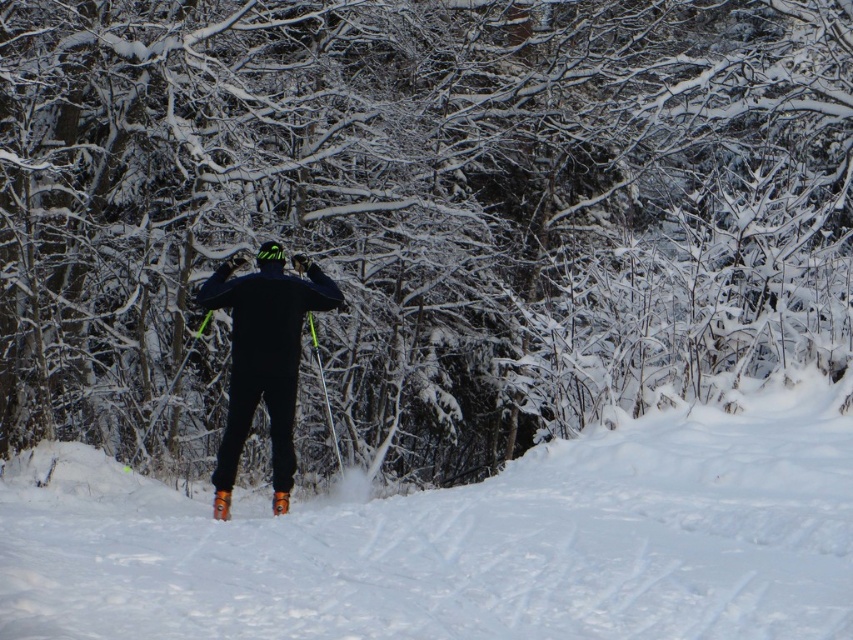
Who is positioned more to the right, white fluffy snow at center or matte black snowboarder at center?

From the viewer's perspective, white fluffy snow at center appears more on the right side.

Between white fluffy snow at center and matte black snowboarder at center, which one is positioned higher?

matte black snowboarder at center is above.

Measure the distance between point (798, 465) and camera.

They are 11.46 meters apart.

Find the location of `white fluffy snow at center`. white fluffy snow at center is located at coordinates (465, 540).

How distant is matte black snowboarder at center from orange plastic ski at lower center?

matte black snowboarder at center is 3.88 feet from orange plastic ski at lower center.

At what (x,y) coordinates should I click in order to perform the action: click on matte black snowboarder at center. Please return your answer as a coordinate pair (x, y). The image size is (853, 640). Looking at the image, I should click on (263, 358).

This screenshot has width=853, height=640. Describe the element at coordinates (263, 358) in the screenshot. I see `matte black snowboarder at center` at that location.

At what (x,y) coordinates should I click in order to perform the action: click on matte black snowboarder at center. Please return your answer as a coordinate pair (x, y). The height and width of the screenshot is (640, 853). Looking at the image, I should click on (263, 358).

Is white fluffy snow at center further to camera compared to orange plastic ski at lower center?

No, it is in front of orange plastic ski at lower center.

Is point (573, 442) positioned in front of point (218, 516)?

That is False.

Identify the location of white fluffy snow at center. (465, 540).